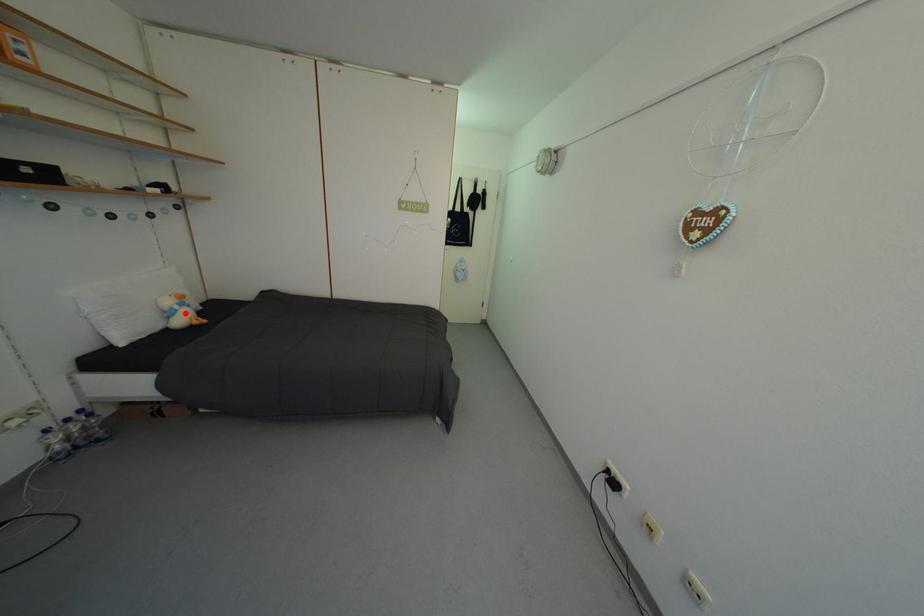
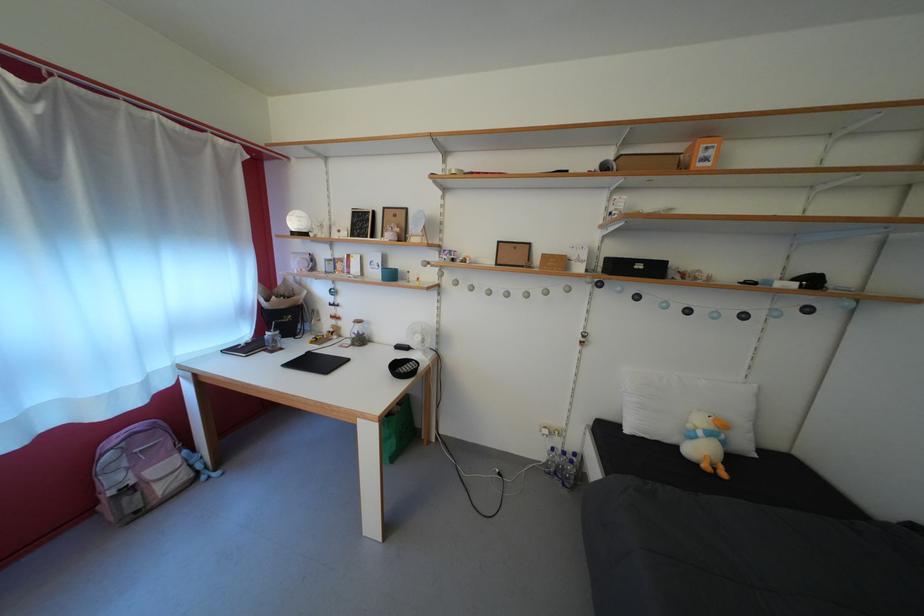
Question: I am providing you with two images of the same scene from different viewpoints. A red point is shown in image1. For the corresponding object point in image2, is it positioned nearer or farther from the camera?

Choices:
 (A) Nearer
 (B) Farther

Answer: (B)